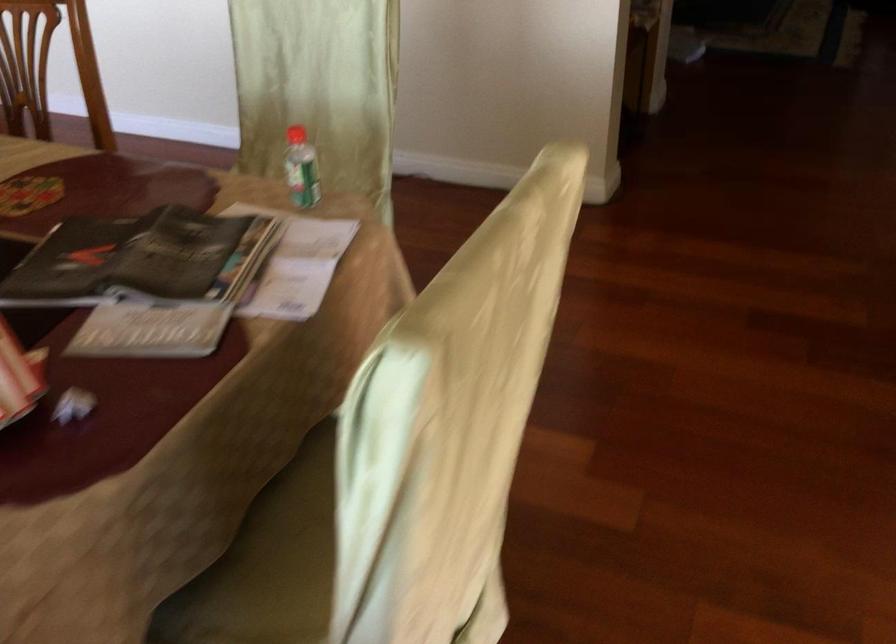
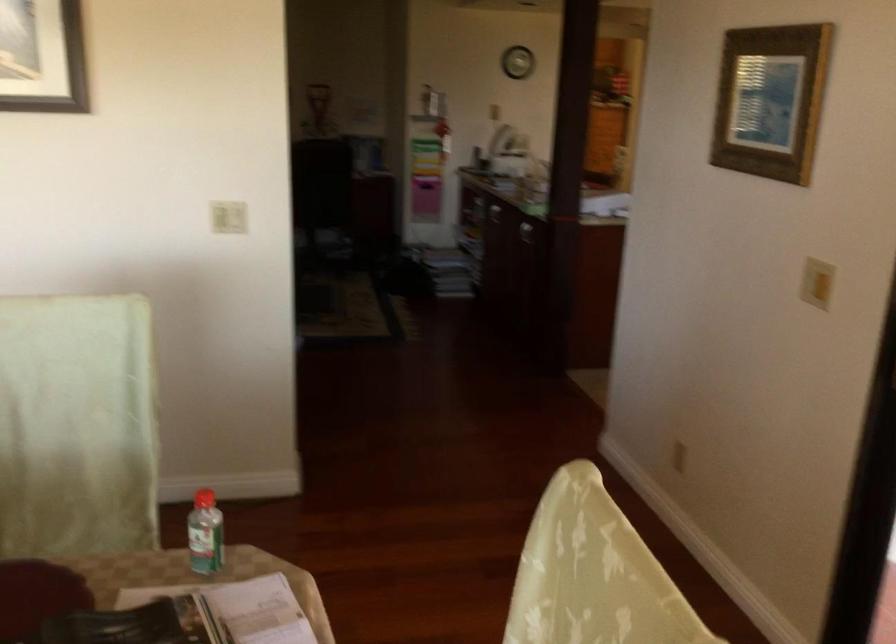
The point at (297, 162) is marked in the first image. Where is the corresponding point in the second image?

(204, 534)